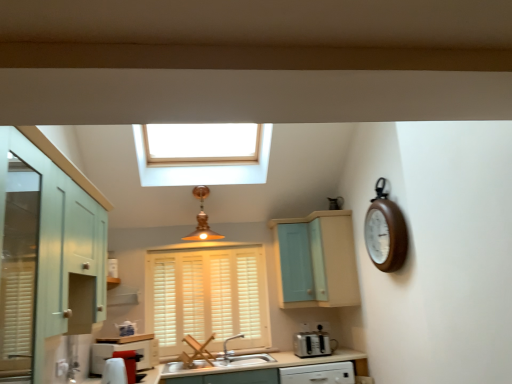
You are a GUI agent. You are given a task and a screenshot of the screen. Output one action in this format:
    pyautogui.click(x=<x>, y=<y>)
    Task: Click on the satin silver toaster at lower center
    This screenshot has width=512, height=384.
    Given the screenshot: What is the action you would take?
    pyautogui.click(x=313, y=343)

Locate an element on the screen. satin nickel faucet at sink center is located at coordinates (227, 342).

This screenshot has height=384, width=512. In order to click on screen door on the right of copper metallic pendant light at center in this screenshot , I will do `click(295, 262)`.

Is copper metallic pendant light at center far from light blue wood cabinet at upper center?

They are positioned close to each other.

Which is less distant, (251, 346) or (103, 360)?

Point (251, 346).

Considering the relative sizes of white wood blinds at center and white glossy oven at lower left in the image provided, is white wood blinds at center smaller than white glossy oven at lower left?

No, white wood blinds at center is not smaller than white glossy oven at lower left.

Is white wood blinds at center touching white glossy oven at lower left?

No, white wood blinds at center is not next to white glossy oven at lower left.

Does white wood blinds at center have a greater height compared to white glossy oven at lower left?

Yes, white wood blinds at center is taller than white glossy oven at lower left.

Based on the photo, is wooden clock at right oriented towards copper metallic pendant light at center?

No, wooden clock at right is not oriented towards copper metallic pendant light at center.

Is wooden clock at right thinner than copper metallic pendant light at center?

Yes.

Which object is further away from the camera, wooden clock at right or copper metallic pendant light at center?

Positioned behind is copper metallic pendant light at center.

How different are the orientations of wooden clock at right and copper metallic pendant light at center in degrees?

They differ by 89.9 degrees in their facing directions.

Is the position of white glossy oven at lower left less distant than that of wooden clock at right?

No.

Consider the image. Is white glossy oven at lower left positioned with its back to wooden clock at right?

That's not correct — white glossy oven at lower left is not looking away from wooden clock at right.

Is white glossy oven at lower left at the right side of wooden clock at right?

In fact, white glossy oven at lower left is to the left of wooden clock at right.

Can wooden clock at right be found inside white glossy oven at lower left?

Actually, wooden clock at right is outside white glossy oven at lower left.

Is wooden clock at right in front of satin silver toaster at lower center?

Yes.

Does wooden clock at right turn towards satin silver toaster at lower center?

No, wooden clock at right is not turned towards satin silver toaster at lower center.

From the image's perspective, which is above, wooden clock at right or satin silver toaster at lower center?

wooden clock at right appears higher in the image.

Does wooden clock at right have a larger size compared to satin silver toaster at lower center?

Correct, wooden clock at right is larger in size than satin silver toaster at lower center.

Is light blue wood cabinet at upper center far away from white ceramic sink at center?

They are positioned close to each other.

This screenshot has width=512, height=384. I want to click on sink in front of the light blue wood cabinet at upper center, so click(244, 360).

Which object is thinner, light blue wood cabinet at upper center or white ceramic sink at center?

white ceramic sink at center.

Based on their positions, is light blue wood cabinet at upper center located to the left or right of white ceramic sink at center?

From the image, it's evident that light blue wood cabinet at upper center is to the right of white ceramic sink at center.

Are white ceramic sink at center and copper metallic pendant light at center located far from each other?

Yes, white ceramic sink at center and copper metallic pendant light at center are located far from each other.

Is white ceramic sink at center inside the boundaries of copper metallic pendant light at center, or outside?

white ceramic sink at center is not inside copper metallic pendant light at center, it's outside.

Which of these two, white ceramic sink at center or copper metallic pendant light at center, stands taller?

copper metallic pendant light at center is taller.

Locate an element on the screen. Image resolution: width=512 pixels, height=384 pixels. screen door that is below the copper metallic pendant light at center (from the image's perspective) is located at coordinates (295, 262).

In the image, there is a white wood blinds at center. Find the location of `oven below it (from a real-world perspective)`. oven below it (from a real-world perspective) is located at coordinates (123, 350).

Looking at this image, considering their positions, is white glossy oven at lower left positioned further to satin silver toaster at lower center than white wood blinds at center?

white glossy oven at lower left lies further to satin silver toaster at lower center than the other object.

When comparing their distances from wooden clock at right, does light blue wood cabinet at center, which is the second cabinetry in front-to-back order, or satin nickel faucet at sink center seem further?

Among the two, satin nickel faucet at sink center is located further to wooden clock at right.

Which object lies nearer to the anchor point white glossy oven at lower left, satin nickel faucet at sink center or satin silver toaster at lower center?

satin nickel faucet at sink center.

Which object lies nearer to the anchor point white ceramic sink at center, white wood blinds at center or light blue wood cabinet at center, the 1th cabinetry from the back?

Based on the image, white wood blinds at center appears to be nearer to white ceramic sink at center.

Which object lies nearer to the anchor point white ceramic sink at center, white glossy oven at lower left or light blue wood cabinet at center, the 1th cabinetry from the back?

white glossy oven at lower left is positioned closer to the anchor white ceramic sink at center.

Estimate the real-world distances between objects in this image. Which object is further from white glossy oven at lower left, copper metallic pendant light at center or white ceramic sink at center?

The object further to white glossy oven at lower left is copper metallic pendant light at center.

Based on their spatial positions, is white glossy oven at lower left or satin silver toaster at lower center further from copper metallic pendant light at center?

satin silver toaster at lower center is further to copper metallic pendant light at center.

Estimate the real-world distances between objects in this image. Which object is further from light blue wood cabinet at center, which is the second cabinetry in front-to-back order, satin silver toaster at lower center or light blue wood cabinet at upper center?

satin silver toaster at lower center.

The image size is (512, 384). Identify the location of appliance between mint green wood cabinet at left, the first cabinetry positioned from the front, and satin nickel faucet at sink center, along the z-axis. (313, 343).

The width and height of the screenshot is (512, 384). I want to click on sink situated between white wood blinds at center and wooden clock at right from left to right, so click(244, 360).

What are the coordinates of `screen door between white glossy oven at lower left and satin silver toaster at lower center in the horizontal direction` in the screenshot? It's located at (295, 262).

At what (x,y) coordinates should I click in order to perform the action: click on appliance between wooden clock at right and white ceramic sink at center from top to bottom. Please return your answer as a coordinate pair (x, y). The width and height of the screenshot is (512, 384). Looking at the image, I should click on (313, 343).